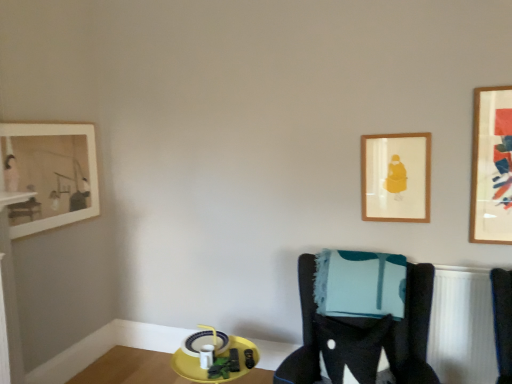
What do you see at coordinates (396, 177) in the screenshot?
I see `wooden framed print at upper right, marked as the 2th picture frame in a right-to-left arrangement` at bounding box center [396, 177].

Where is `matte white picture frame at upper left, the 1th picture frame viewed from the left`? matte white picture frame at upper left, the 1th picture frame viewed from the left is located at coordinates (49, 174).

The width and height of the screenshot is (512, 384). What do you see at coordinates (492, 166) in the screenshot?
I see `wooden framed artwork at upper right, positioned as the first picture frame in right-to-left order` at bounding box center [492, 166].

Where is `velvet black chair at center`? velvet black chair at center is located at coordinates (x=362, y=336).

Where is `wooden framed print at upper right, the 2th picture frame when ordered from left to right`? This screenshot has height=384, width=512. wooden framed print at upper right, the 2th picture frame when ordered from left to right is located at coordinates (396, 177).

Does point (59, 177) come farther from viewer compared to point (367, 383)?

Yes, it is behind point (367, 383).

From a real-world perspective, is matte white picture frame at upper left, which is the 3th picture frame from right to left, located higher than velvet black chair at center?

Yes, from a real-world perspective, matte white picture frame at upper left, which is the 3th picture frame from right to left, is on top of velvet black chair at center.

Is matte white picture frame at upper left, which is the 3th picture frame from right to left, positioned with its back to velvet black chair at center?

matte white picture frame at upper left, which is the 3th picture frame from right to left, does not have its back to velvet black chair at center.

Considering the sizes of objects matte white picture frame at upper left, the 1th picture frame viewed from the left, and velvet black chair at center in the image provided, who is thinner, matte white picture frame at upper left, the 1th picture frame viewed from the left, or velvet black chair at center?

Thinner between the two is matte white picture frame at upper left, the 1th picture frame viewed from the left.

Considering the sizes of objects matte white picture frame at upper left, which is the 3th picture frame from right to left, and wooden framed artwork at upper right, positioned as the first picture frame in right-to-left order, in the image provided, who is smaller, matte white picture frame at upper left, which is the 3th picture frame from right to left, or wooden framed artwork at upper right, positioned as the first picture frame in right-to-left order,?

wooden framed artwork at upper right, positioned as the first picture frame in right-to-left order, is smaller.

In the scene shown: From a real-world perspective, is matte white picture frame at upper left, which is the 3th picture frame from right to left, physically below wooden framed artwork at upper right, positioned as the first picture frame in right-to-left order?

Yes, from a real-world perspective, matte white picture frame at upper left, which is the 3th picture frame from right to left, is under wooden framed artwork at upper right, positioned as the first picture frame in right-to-left order.

Is matte white picture frame at upper left, which is the 3th picture frame from right to left, looking in the opposite direction of wooden framed artwork at upper right, arranged as the third picture frame when viewed from the left?

No, matte white picture frame at upper left, which is the 3th picture frame from right to left, is not facing the opposite direction of wooden framed artwork at upper right, arranged as the third picture frame when viewed from the left.

Would you say matte white picture frame at upper left, the 1th picture frame viewed from the left, is a long distance from wooden framed artwork at upper right, arranged as the third picture frame when viewed from the left?

matte white picture frame at upper left, the 1th picture frame viewed from the left, is positioned a significant distance from wooden framed artwork at upper right, arranged as the third picture frame when viewed from the left.

Is wooden framed artwork at upper right, positioned as the first picture frame in right-to-left order, inside the boundaries of velvet black chair at center, or outside?

wooden framed artwork at upper right, positioned as the first picture frame in right-to-left order, is not inside velvet black chair at center, it's outside.

Based on the photo, is wooden framed artwork at upper right, positioned as the first picture frame in right-to-left order, taller than velvet black chair at center?

Yes, wooden framed artwork at upper right, positioned as the first picture frame in right-to-left order, is taller than velvet black chair at center.

Is wooden framed artwork at upper right, arranged as the third picture frame when viewed from the left, in front of velvet black chair at center?

No, it is not.

From a real-world perspective, between wooden framed artwork at upper right, arranged as the third picture frame when viewed from the left, and velvet black chair at center, who is vertically higher?

wooden framed artwork at upper right, arranged as the third picture frame when viewed from the left.

Does yellow plastic tray at lower center appear on the left side of wooden framed print at upper right, the 2th picture frame when ordered from left to right?

Correct, you'll find yellow plastic tray at lower center to the left of wooden framed print at upper right, the 2th picture frame when ordered from left to right.

Find the location of `the 1st picture frame counting from the right of the yellow plastic tray at lower center`. the 1st picture frame counting from the right of the yellow plastic tray at lower center is located at coordinates (396, 177).

From the image's perspective, is yellow plastic tray at lower center located above or below wooden framed print at upper right, marked as the 2th picture frame in a right-to-left arrangement?

Clearly, from the image's perspective, yellow plastic tray at lower center is below wooden framed print at upper right, marked as the 2th picture frame in a right-to-left arrangement.

Consider the image. Considering the sizes of objects yellow plastic tray at lower center and wooden framed print at upper right, marked as the 2th picture frame in a right-to-left arrangement, in the image provided, who is shorter, yellow plastic tray at lower center or wooden framed print at upper right, marked as the 2th picture frame in a right-to-left arrangement,?

With less height is yellow plastic tray at lower center.

Considering the sizes of objects wooden framed artwork at upper right, positioned as the first picture frame in right-to-left order, and matte white picture frame at upper left, which is the 3th picture frame from right to left, in the image provided, who is bigger, wooden framed artwork at upper right, positioned as the first picture frame in right-to-left order, or matte white picture frame at upper left, which is the 3th picture frame from right to left,?

matte white picture frame at upper left, which is the 3th picture frame from right to left, is bigger.

From a real-world perspective, is wooden framed artwork at upper right, positioned as the first picture frame in right-to-left order, physically located above or below matte white picture frame at upper left, which is the 3th picture frame from right to left?

In terms of real-world spatial position, wooden framed artwork at upper right, positioned as the first picture frame in right-to-left order, is above matte white picture frame at upper left, which is the 3th picture frame from right to left.

At what (x,y) coordinates should I click in order to perform the action: click on picture frame in front of the matte white picture frame at upper left, the 1th picture frame viewed from the left. Please return your answer as a coordinate pair (x, y). The width and height of the screenshot is (512, 384). Looking at the image, I should click on (492, 166).

Is point (365, 191) in front of point (403, 351)?

That is False.

Which picture frame is the 3rd one when counting from the back of the velvet black chair at center? Please provide its 2D coordinates.

[(396, 177)]

Is wooden framed print at upper right, the 2th picture frame when ordered from left to right, to the left or to the right of velvet black chair at center in the image?

wooden framed print at upper right, the 2th picture frame when ordered from left to right, is to the right of velvet black chair at center.

Measure the distance between wooden framed print at upper right, marked as the 2th picture frame in a right-to-left arrangement, and velvet black chair at center.

27.18 inches.

Is point (36, 158) farther from camera compared to point (137, 373)?

No, it is not.

How many degrees apart are the facing directions of matte white picture frame at upper left, the 1th picture frame viewed from the left, and yellow plastic tray at lower center?

The facing directions of matte white picture frame at upper left, the 1th picture frame viewed from the left, and yellow plastic tray at lower center are 0.481 degrees apart.

Is matte white picture frame at upper left, the 1th picture frame viewed from the left, far from yellow plastic tray at lower center?

matte white picture frame at upper left, the 1th picture frame viewed from the left, is positioned a significant distance from yellow plastic tray at lower center.

From the image's perspective, is matte white picture frame at upper left, which is the 3th picture frame from right to left, beneath yellow plastic tray at lower center?

Actually, matte white picture frame at upper left, which is the 3th picture frame from right to left, appears above yellow plastic tray at lower center in the image.

Locate an element on the screen. The image size is (512, 384). the 2nd picture frame above the velvet black chair at center (from a real-world perspective) is located at coordinates (49, 174).

This screenshot has height=384, width=512. What are the coordinates of `picture frame that is the 2nd one when counting leftward from the wooden framed artwork at upper right, positioned as the first picture frame in right-to-left order` in the screenshot? It's located at (49, 174).

Looking at the image, which one is located closer to matte white picture frame at upper left, which is the 3th picture frame from right to left, velvet black chair at center or yellow plastic tray at lower center?

Based on the image, yellow plastic tray at lower center appears to be nearer to matte white picture frame at upper left, which is the 3th picture frame from right to left.

When comparing their distances from matte white picture frame at upper left, which is the 3th picture frame from right to left, does wooden framed artwork at upper right, positioned as the first picture frame in right-to-left order, or velvet black chair at center seem closer?

velvet black chair at center is closer to matte white picture frame at upper left, which is the 3th picture frame from right to left.

Considering their positions, is velvet black chair at center positioned closer to wooden framed artwork at upper right, positioned as the first picture frame in right-to-left order, than yellow plastic tray at lower center?

The object closer to wooden framed artwork at upper right, positioned as the first picture frame in right-to-left order, is velvet black chair at center.

Which object lies further to the anchor point velvet black chair at center, matte white picture frame at upper left, the 1th picture frame viewed from the left, or yellow plastic tray at lower center?

matte white picture frame at upper left, the 1th picture frame viewed from the left, is further to velvet black chair at center.

Estimate the real-world distances between objects in this image. Which object is further from wooden framed artwork at upper right, positioned as the first picture frame in right-to-left order, yellow plastic tray at lower center or wooden framed print at upper right, marked as the 2th picture frame in a right-to-left arrangement?

Based on the image, yellow plastic tray at lower center appears to be further to wooden framed artwork at upper right, positioned as the first picture frame in right-to-left order.

Considering their positions, is matte white picture frame at upper left, which is the 3th picture frame from right to left, positioned closer to wooden framed artwork at upper right, arranged as the third picture frame when viewed from the left, than wooden framed print at upper right, the 2th picture frame when ordered from left to right?

The object closer to wooden framed artwork at upper right, arranged as the third picture frame when viewed from the left, is wooden framed print at upper right, the 2th picture frame when ordered from left to right.

Based on their spatial positions, is wooden framed print at upper right, the 2th picture frame when ordered from left to right, or matte white picture frame at upper left, which is the 3th picture frame from right to left, closer to yellow plastic tray at lower center?

Based on the image, matte white picture frame at upper left, which is the 3th picture frame from right to left, appears to be nearer to yellow plastic tray at lower center.

Looking at the image, which one is located further to wooden framed print at upper right, marked as the 2th picture frame in a right-to-left arrangement, wooden framed artwork at upper right, positioned as the first picture frame in right-to-left order, or yellow plastic tray at lower center?

yellow plastic tray at lower center.

Locate an element on the screen. The width and height of the screenshot is (512, 384). furniture between yellow plastic tray at lower center and wooden framed print at upper right, the 2th picture frame when ordered from left to right, from left to right is located at coordinates (362, 336).

You are a GUI agent. You are given a task and a screenshot of the screen. Output one action in this format:
    pyautogui.click(x=<x>, y=<y>)
    Task: Click on the furniture situated between matte white picture frame at upper left, which is the 3th picture frame from right to left, and wooden framed artwork at upper right, positioned as the first picture frame in right-to-left order, from left to right
    The image size is (512, 384).
    Given the screenshot: What is the action you would take?
    pyautogui.click(x=362, y=336)

Identify the location of table between matte white picture frame at upper left, the 1th picture frame viewed from the left, and wooden framed artwork at upper right, arranged as the third picture frame when viewed from the left, in the horizontal direction. (130, 368).

This screenshot has width=512, height=384. Identify the location of picture frame between matte white picture frame at upper left, which is the 3th picture frame from right to left, and wooden framed artwork at upper right, positioned as the first picture frame in right-to-left order, from left to right. (396, 177).